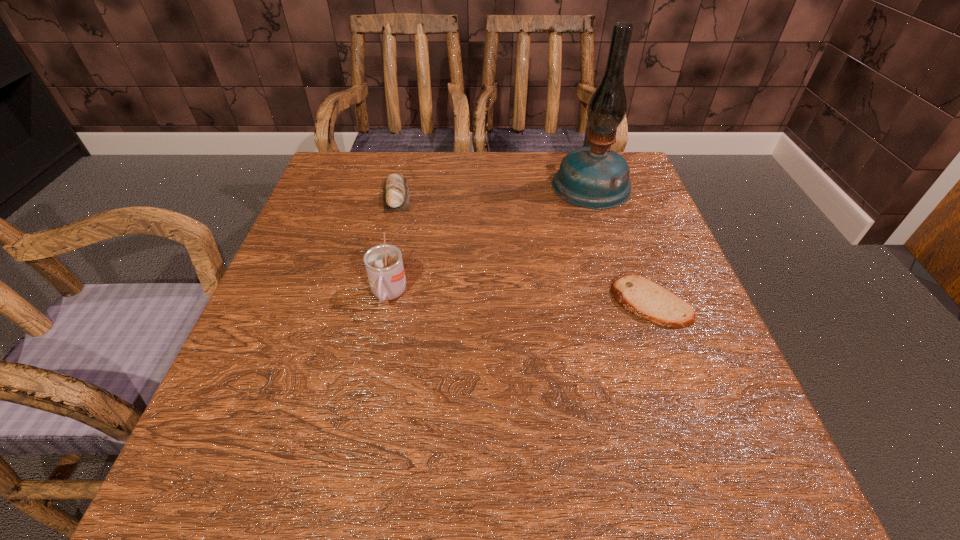
This screenshot has height=540, width=960. What are the coordinates of `oil lamp at the far edge` in the screenshot? It's located at (594, 177).

This screenshot has width=960, height=540. I want to click on pita bread at the far edge, so click(395, 189).

Find the location of a particular element. object that is positioned at the left edge is located at coordinates (395, 189).

Image resolution: width=960 pixels, height=540 pixels. Find the location of `oil lamp present at the right edge`. oil lamp present at the right edge is located at coordinates (594, 177).

In order to click on pita bread that is at the right edge in this screenshot , I will do `click(643, 298)`.

Identify the location of object at the far left corner. (395, 189).

Image resolution: width=960 pixels, height=540 pixels. Find the location of `object present at the far right corner`. object present at the far right corner is located at coordinates tap(594, 177).

This screenshot has width=960, height=540. In the image, there is a desktop. Find the location of `vacant space at the far edge`. vacant space at the far edge is located at coordinates (454, 177).

In the image, there is a desktop. What are the coordinates of `free region at the near edge` in the screenshot? It's located at (534, 469).

Where is `free space at the left edge`? free space at the left edge is located at coordinates (265, 409).